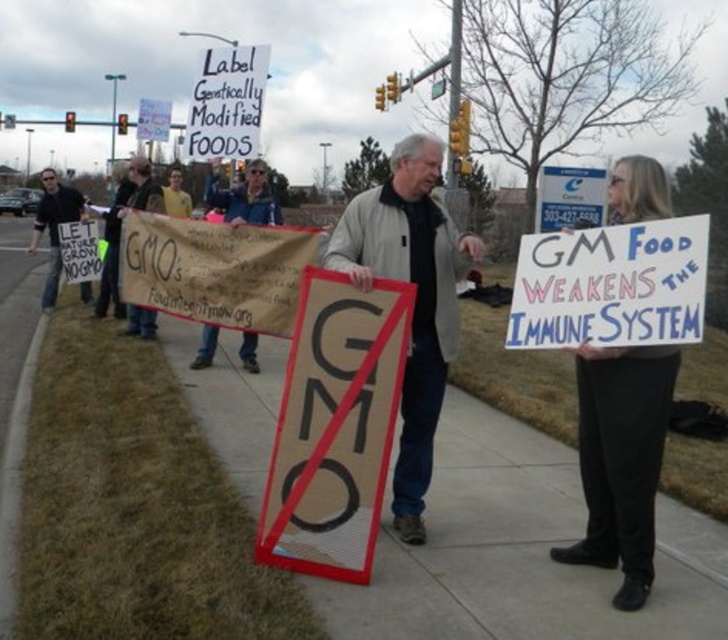
Is handwritten cardboard sign at center wider than cardboard sign at center?

Indeed, handwritten cardboard sign at center has a greater width compared to cardboard sign at center.

Between handwritten cardboard sign at center and cardboard sign at center, which one has more height?

cardboard sign at center is taller.

Does point (657, 269) come behind point (138, 308)?

No, it is not.

At what (x,y) coordinates should I click in order to perform the action: click on handwritten cardboard sign at center. Please return your answer as a coordinate pair (x, y). This screenshot has width=728, height=640. Looking at the image, I should click on (609, 285).

Between handwritten cardboard sign at center and white paper sign at upper center, which one has less height?

handwritten cardboard sign at center is shorter.

Does handwritten cardboard sign at center have a greater height compared to white paper sign at upper center?

Incorrect, handwritten cardboard sign at center's height is not larger of white paper sign at upper center's.

Is point (522, 348) more distant than point (199, 122)?

No, it is not.

At what (x,y) coordinates should I click in order to perform the action: click on handwritten cardboard sign at center. Please return your answer as a coordinate pair (x, y). This screenshot has height=640, width=728. Looking at the image, I should click on (609, 285).

Can you confirm if concrete sidewalk at center is positioned above handwritten cardboard sign at center?

No.

In the scene shown: Does concrete sidewalk at center have a greater width compared to handwritten cardboard sign at center?

Yes.

This screenshot has height=640, width=728. Identify the location of concrete sidewalk at center. (149, 492).